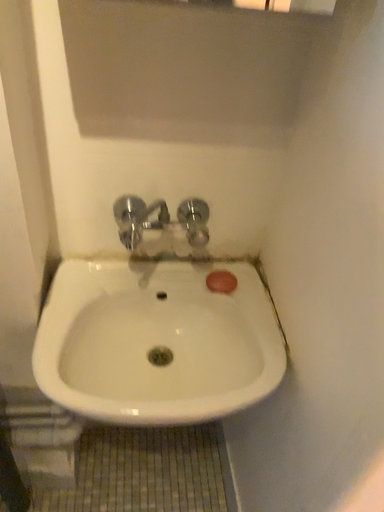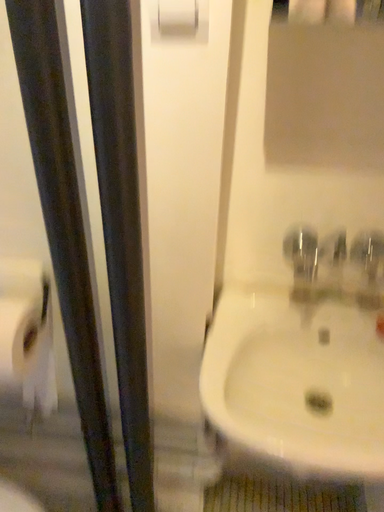
Question: How did the camera likely rotate when shooting the video?

Choices:
 (A) rotated upward
 (B) rotated downward

Answer: (A)